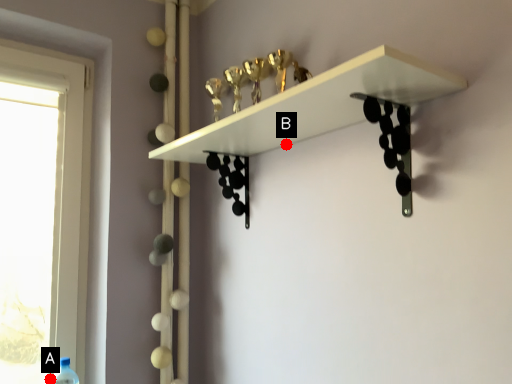
Question: Two points are circled on the image, labeled by A and B beside each circle. Which point is closer to the camera?

Choices:
 (A) A is closer
 (B) B is closer

Answer: (B)